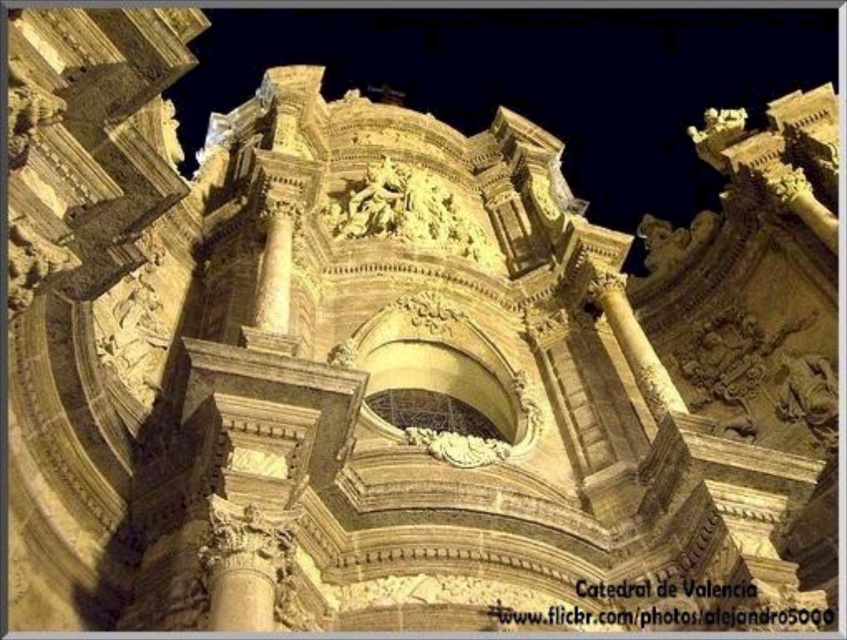
Question: Does golden stone sculpture at center have a greater width compared to golden stone column at center?

Choices:
 (A) yes
 (B) no

Answer: (A)

Question: Which object is closer to the camera taking this photo?

Choices:
 (A) golden stone sculpture at center
 (B) golden stone column at center

Answer: (A)

Question: Can you confirm if golden stone sculpture at center is smaller than golden stone column at center?

Choices:
 (A) yes
 (B) no

Answer: (B)

Question: Is golden stone sculpture at center thinner than golden stone column at center?

Choices:
 (A) no
 (B) yes

Answer: (A)